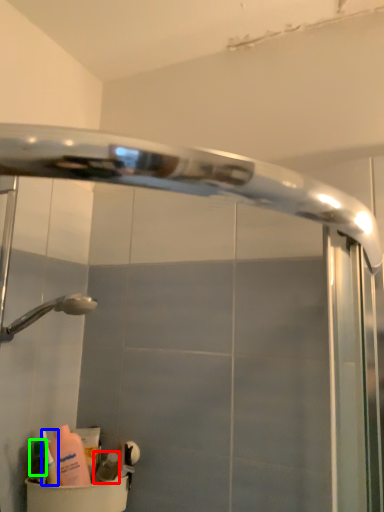
Question: Considering the real-world distances, which object is closest to toiletry (highlighted by a red box)? cleaning product (highlighted by a blue box) or toiletry (highlighted by a green box).

Choices:
 (A) cleaning product
 (B) toiletry

Answer: (A)